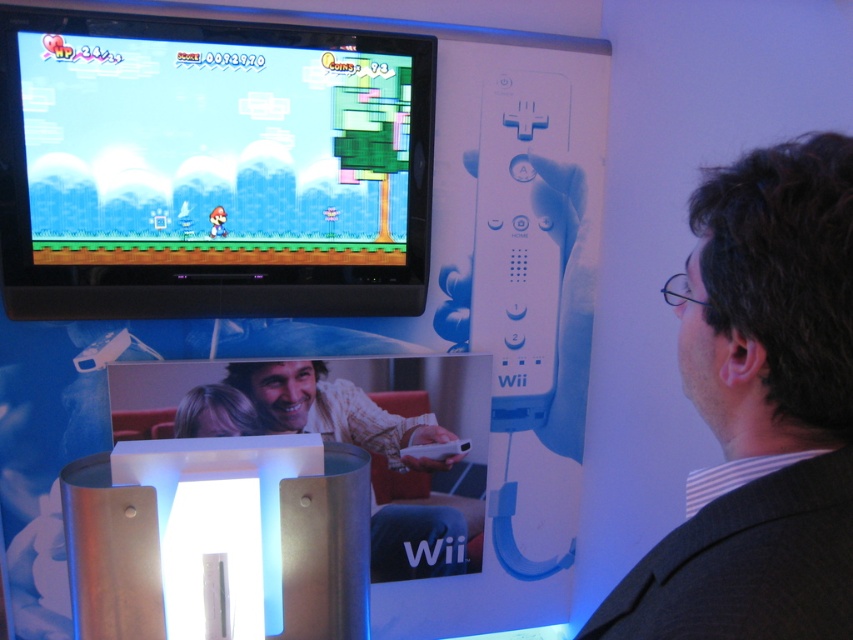
Question: Which object is farther from the camera taking this photo?

Choices:
 (A) matte plastic screen at upper center
 (B) blonde hair at center

Answer: (B)

Question: Which point appears farthest from the camera in this image?

Choices:
 (A) (387, 552)
 (B) (146, 205)
 (C) (241, 420)
 (D) (704, 532)

Answer: (A)

Question: Which point is closer to the camera?

Choices:
 (A) (250, 403)
 (B) (119, 205)
 (C) (339, 403)
 (D) (740, 376)

Answer: (D)

Question: Considering the relative positions of white matte remote at center and blonde hair at center in the image provided, where is white matte remote at center located with respect to blonde hair at center?

Choices:
 (A) right
 (B) left

Answer: (A)

Question: Can you confirm if matte plastic screen at upper center is thinner than dark brown hair at upper right?

Choices:
 (A) yes
 (B) no

Answer: (B)

Question: Observing the image, what is the correct spatial positioning of dark brown hair at upper right in reference to blonde hair at center?

Choices:
 (A) above
 (B) below

Answer: (A)